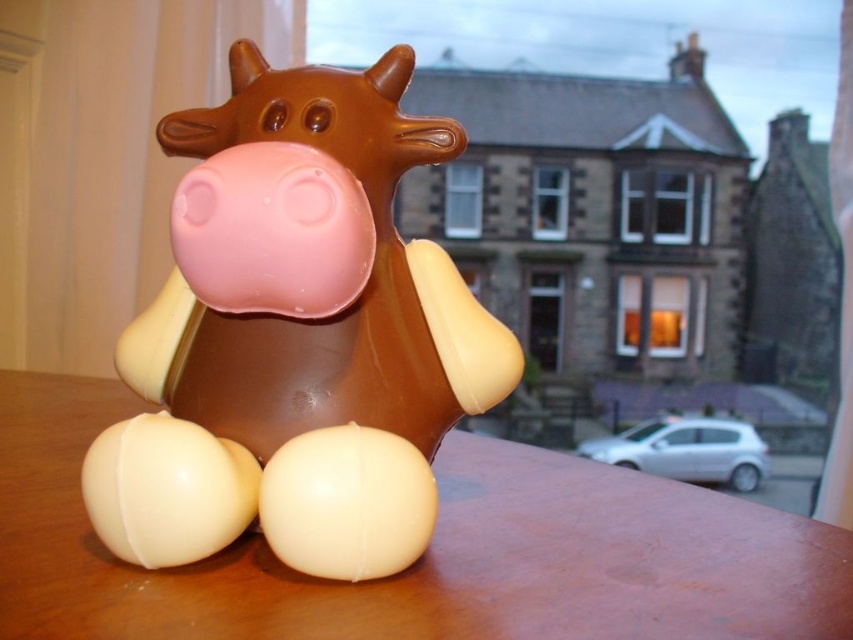
You are standing in front of the cow figure on the wooden surface. You notice two points marked in the scene. Which point is closer to you, point [151,396] or point [685,486]?

Point [151,396] is in front of point [685,486], so it is closer to you.

You are placing a small toy on the wooden table at center. The matte chocolate cow at center is currently occupying space on the table. Can the toy fit on the table without overlapping the cow?

The matte chocolate cow at center is above wooden table at center, so it is occupying space on the table. Therefore, the toy cannot be placed there without overlapping.

You are a delivery drone trying to locate the matte chocolate cow at center in the image. According to the coordinates provided, which part of the image should you focus on to find it?

The matte chocolate cow at center is located at the 2D coordinates point (296, 336), which is near the center of the image.